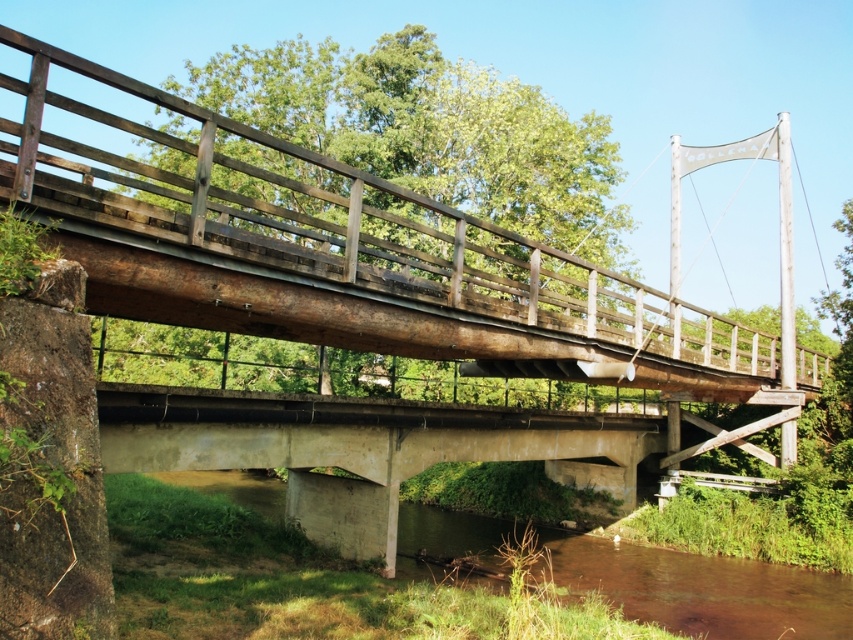
You are standing on the rustic wooden bridge and want to cross to the other side. As you look down, you notice the rusty wood rail at upper center and the brown concrete river at lower center. Which object is closer to you from your current position?

The rusty wood rail at upper center is closer to you because it is in front of the brown concrete river at lower center.

You are standing on the bridge and want to touch the rusty wood rail at upper center. According to the coordinates given, where should you reach to touch it?

The rusty wood rail at upper center is located at point coordinates of (335,252). So you should reach towards the center of the bridge where the coordinates intersect.